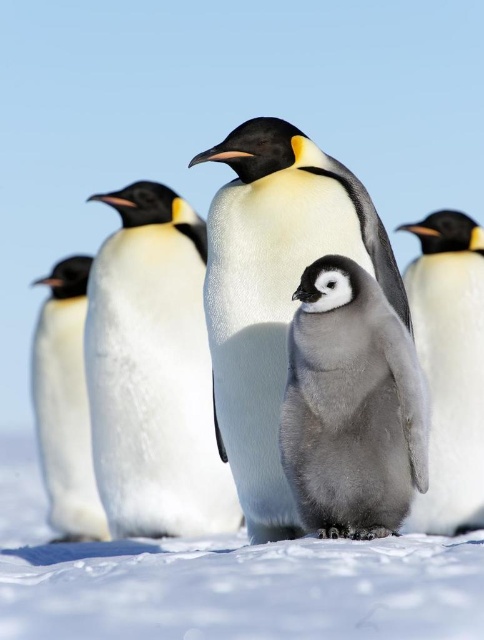
Question: Which of these objects is positioned farthest from the white fluffy snow at center?

Choices:
 (A) white smooth penguin at left
 (B) gray downy penguin at center

Answer: (A)

Question: From the image, what is the correct spatial relationship of white smooth penguin at center in relation to white fluffy penguin at right?

Choices:
 (A) above
 (B) below

Answer: (A)

Question: Among these objects, which one is nearest to the camera?

Choices:
 (A) white smooth penguin at left
 (B) white fluffy penguin at center

Answer: (B)

Question: Can you confirm if white fluffy snow at center is positioned to the right of white fluffy penguin at center?

Choices:
 (A) no
 (B) yes

Answer: (A)

Question: Is white fluffy snow at center to the right of gray downy penguin at center from the viewer's perspective?

Choices:
 (A) yes
 (B) no

Answer: (B)

Question: Based on their relative distances, which object is farther from the white fluffy penguin at right?

Choices:
 (A) white smooth penguin at left
 (B) white fluffy snow at center

Answer: (A)